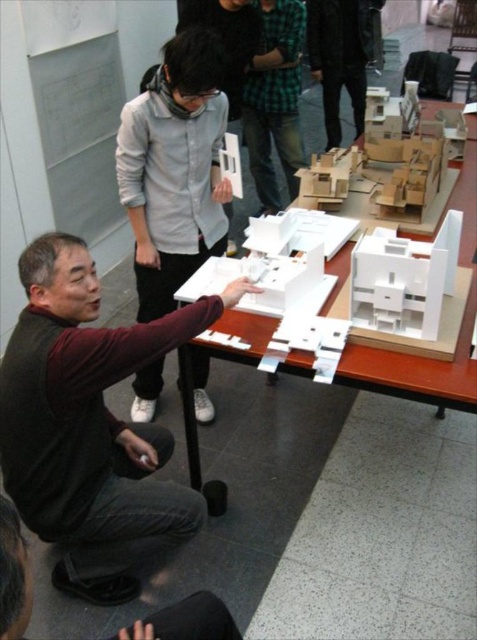
Consider the image. You are an architect standing at the back of the room and want to examine the white matte model at center and the dark green textured pants at center. Which object is closer to you?

The white matte model at center is closer to the viewer than the dark green textured pants at center.

You are a participant in the discussion and need to point out the height difference between the white matte model at center and the dark green textured pants at center. Which one is taller?

The white matte model at center is much taller than the dark green textured pants at center.

You are an architect attending a meeting and see the white cardboard table at center and the dark green textured pants at center. Which object is positioned lower in the image?

The white cardboard table at center is located below dark green textured pants at center, so the white cardboard table at center is positioned lower in the image.